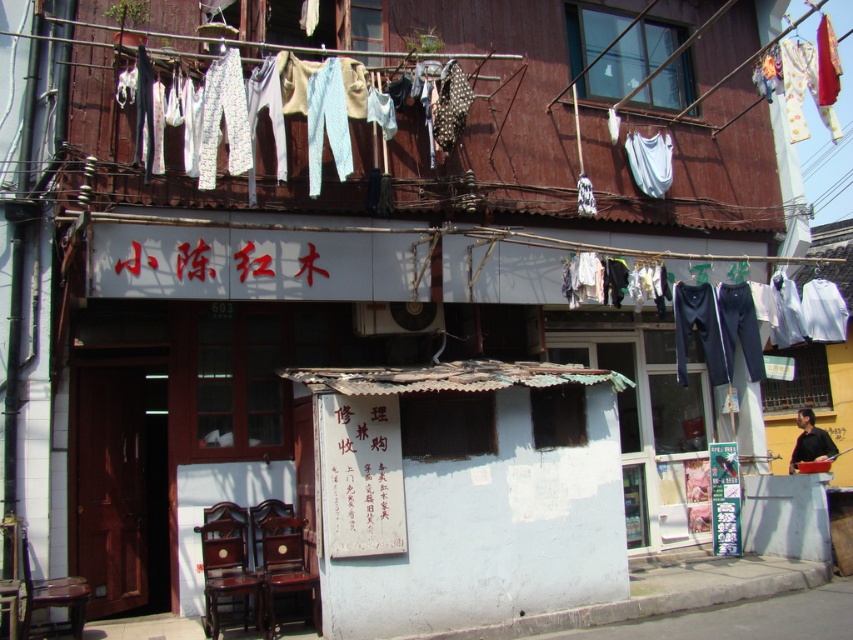
Question: Considering the real-world distances, which object is farthest from the wooden chair at lower left?

Choices:
 (A) black paper sign at center
 (B) light blue fabric at upper center
 (C) mahogany wood chair at lower left

Answer: (B)

Question: Which of the following is the farthest from the observer?

Choices:
 (A) (343, 77)
 (B) (209, 582)
 (C) (44, 636)

Answer: (A)

Question: Among these points, which one is farthest from the camera?

Choices:
 (A) (392, 502)
 (B) (271, 532)
 (C) (828, 40)

Answer: (C)

Question: Can you confirm if mahogany wood chair at lower left is positioned above mahogany wood chair at lower center?

Choices:
 (A) no
 (B) yes

Answer: (A)

Question: Does light blue fabric at upper center appear over mahogany wood chair at lower left?

Choices:
 (A) no
 (B) yes

Answer: (B)

Question: Does black paper sign at center have a lesser width compared to wooden chair at lower left?

Choices:
 (A) yes
 (B) no

Answer: (B)